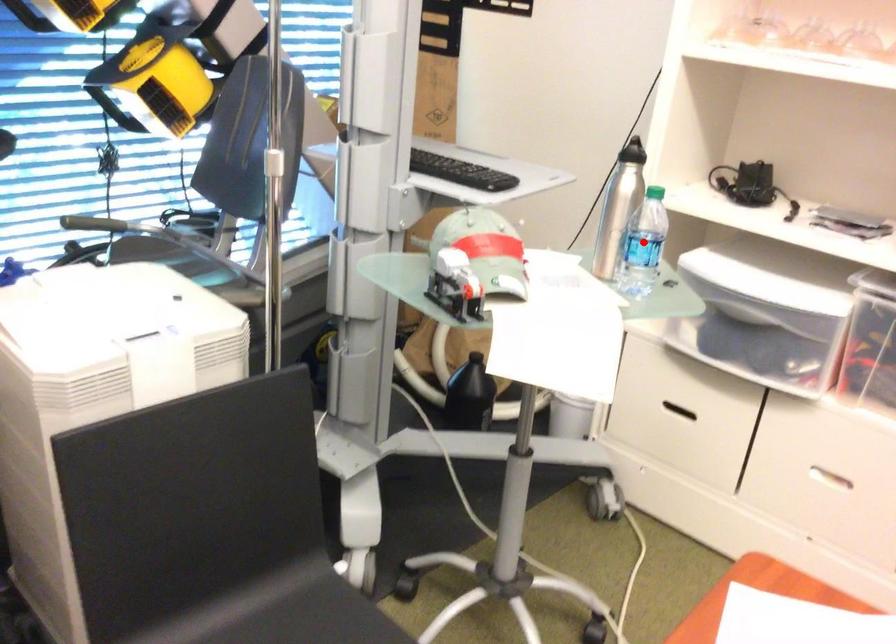
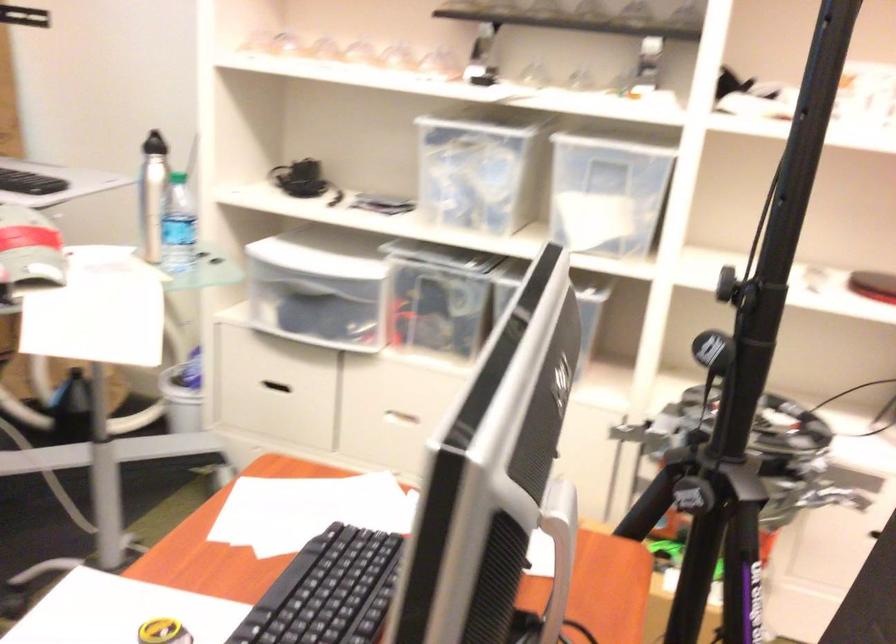
Question: I am providing you with two images of the same scene from different viewpoints. Given a red point in image1, look at the same physical point in image2. Is it:

Choices:
 (A) Closer to the viewpoint
 (B) Farther from the viewpoint

Answer: (B)